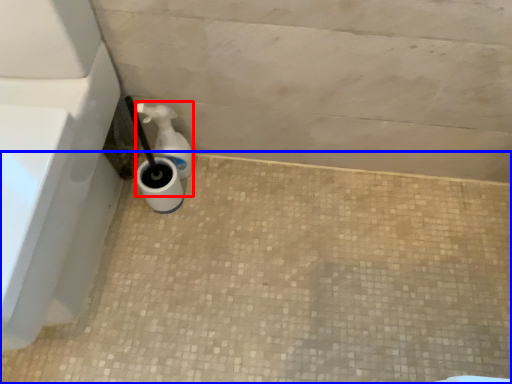
Question: Among these objects, which one is farthest to the camera, soap dispenser (highlighted by a red box) or concrete (highlighted by a blue box)?

Choices:
 (A) soap dispenser
 (B) concrete

Answer: (A)